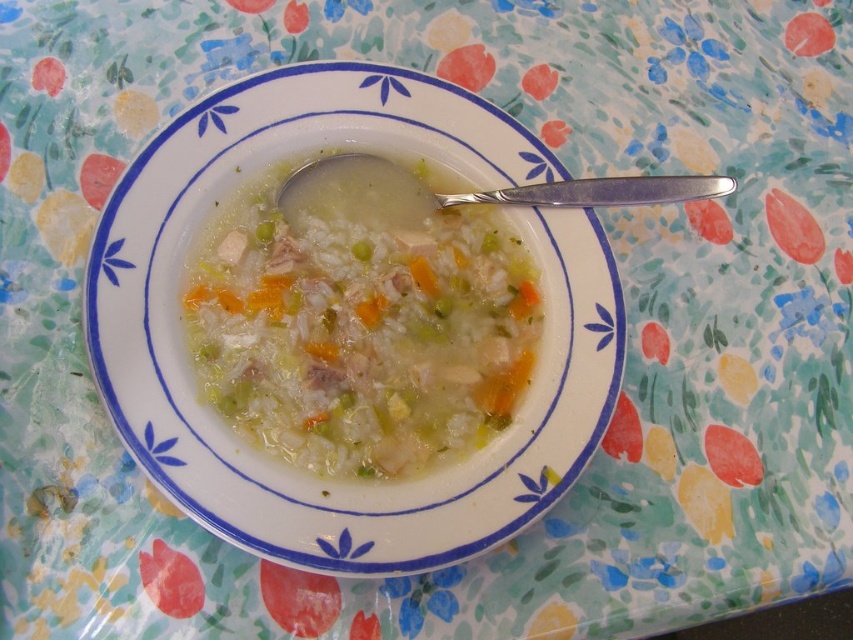
Does white creamy soup at center have a greater width compared to silver metallic spoon at center?

No, white creamy soup at center is not wider than silver metallic spoon at center.

Does white creamy soup at center have a lesser width compared to silver metallic spoon at center?

Yes.

Which is in front, point (296, 454) or point (578, 193)?

Positioned in front is point (296, 454).

Locate an element on the screen. This screenshot has width=853, height=640. white creamy soup at center is located at coordinates (361, 324).